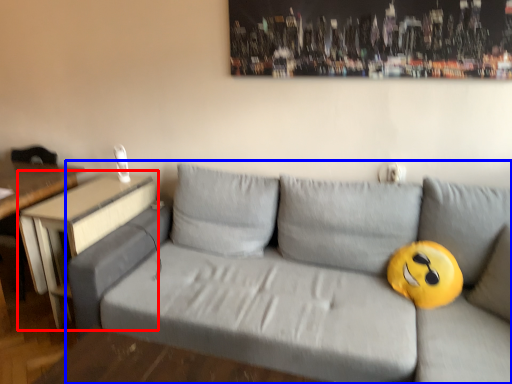
Question: Which point is closer to the camera, table (highlighted by a red box) or studio couch (highlighted by a blue box)?

Choices:
 (A) table
 (B) studio couch

Answer: (B)